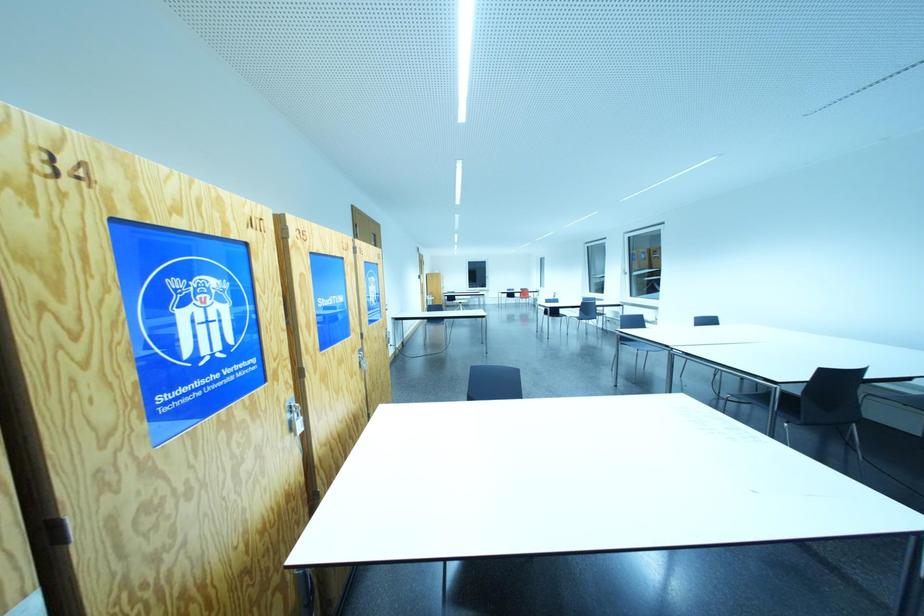
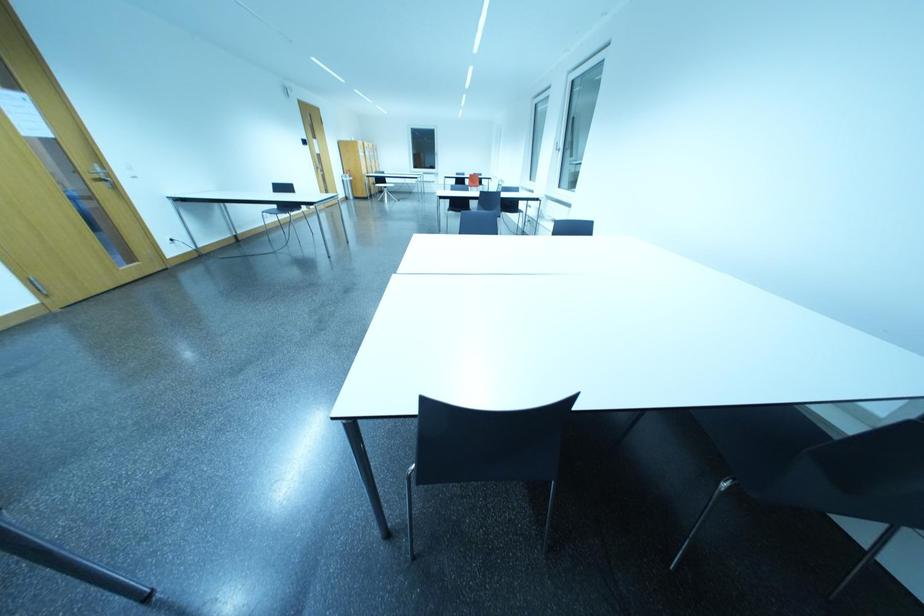
In a continuous first-person perspective shot, in which direction is the camera moving?

The movement direction of the cameraman is right, forward.